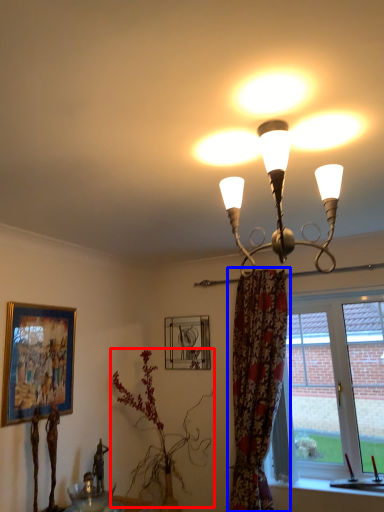
Question: Which point is closer to the camera, plant (highlighted by a red box) or curtain (highlighted by a blue box)?

Choices:
 (A) plant
 (B) curtain

Answer: (B)